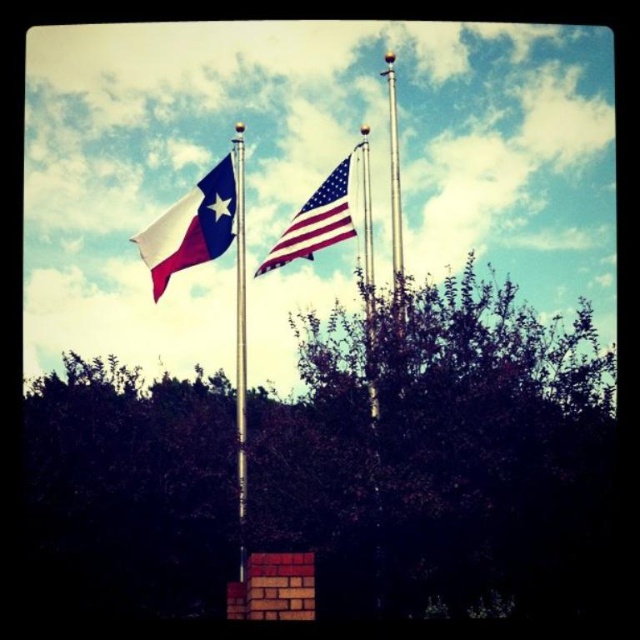
Question: Among these points, which one is farthest from the camera?

Choices:
 (A) (324, 182)
 (B) (241, 276)
 (C) (604, 513)
 (D) (168, 275)

Answer: (D)

Question: From the image, what is the correct spatial relationship of matte blue flag at left in relation to polished metal flag pole at center?

Choices:
 (A) below
 (B) above

Answer: (B)

Question: Estimate the real-world distances between objects in this image. Which object is closer to the green leafy tree at center?

Choices:
 (A) matte blue flag at left
 (B) american flag at center

Answer: (B)

Question: Which object is closer to the camera taking this photo?

Choices:
 (A) matte blue flag at left
 (B) green leafy tree at center
 (C) american flag at center

Answer: (B)

Question: Is american flag at center smaller than polished metal flag pole at center?

Choices:
 (A) no
 (B) yes

Answer: (B)

Question: Does green leafy tree at center have a larger size compared to matte blue flag at left?

Choices:
 (A) yes
 (B) no

Answer: (A)